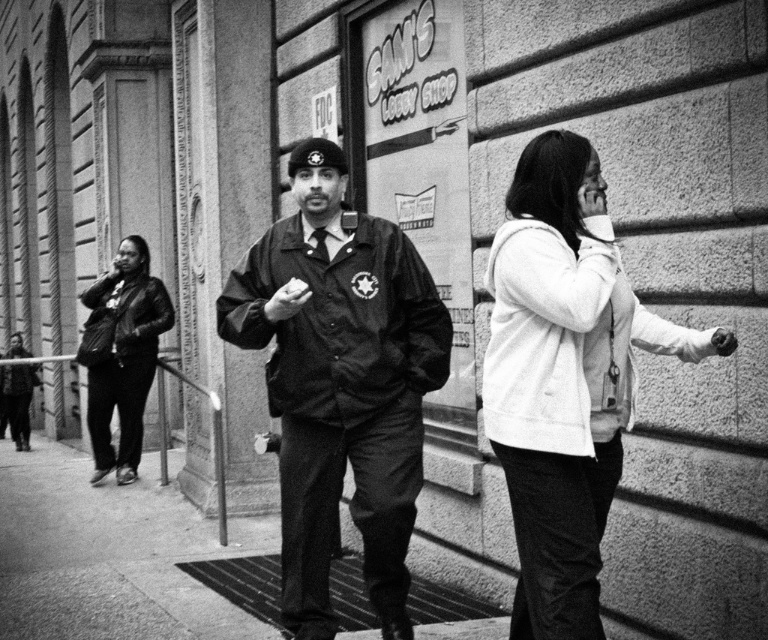
Question: Which point is closer to the camera taking this photo?

Choices:
 (A) (111, 356)
 (B) (412, 269)

Answer: (B)

Question: Does white matte jacket at center lie behind leather jacket at left?

Choices:
 (A) yes
 (B) no

Answer: (B)

Question: Is matte black uniform at center above smooth concrete sidewalk at center?

Choices:
 (A) no
 (B) yes

Answer: (B)

Question: Does white matte jacket at center appear under smooth concrete sidewalk at center?

Choices:
 (A) no
 (B) yes

Answer: (A)

Question: Which of the following is the farthest from the observer?

Choices:
 (A) smooth concrete sidewalk at center
 (B) leather jacket at left

Answer: (B)

Question: Which of the following is the farthest from the observer?

Choices:
 (A) (81, 353)
 (B) (541, 353)
 (C) (70, 509)
 (D) (237, 333)

Answer: (A)